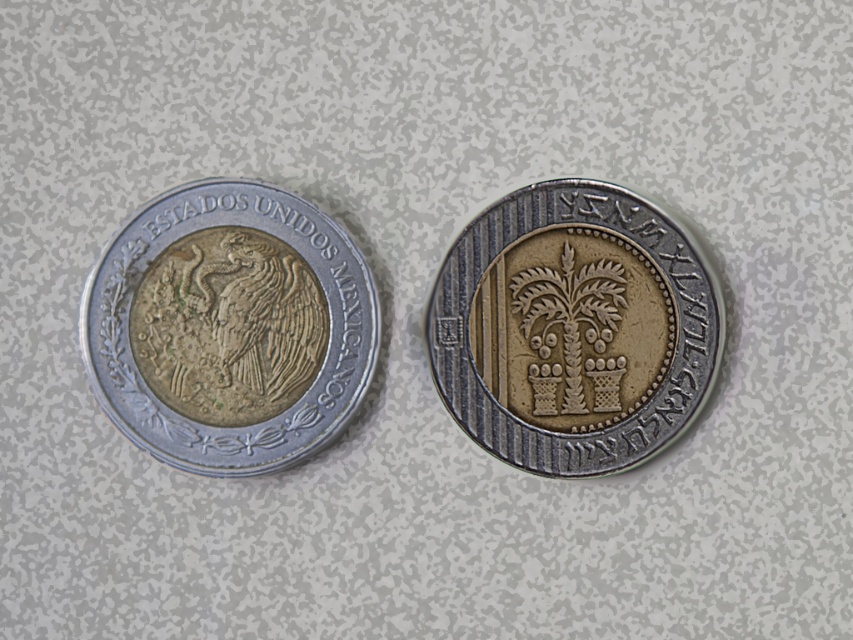
Can you confirm if silver metallic coin at left is shorter than gold-plated palm tree at center?

No, silver metallic coin at left is not shorter than gold-plated palm tree at center.

Which is behind, point (225, 260) or point (583, 262)?

The point (583, 262) is behind.

Is point (100, 300) less distant than point (544, 227)?

That is True.

This screenshot has height=640, width=853. In order to click on silver metallic coin at left in this screenshot , I will do `click(229, 326)`.